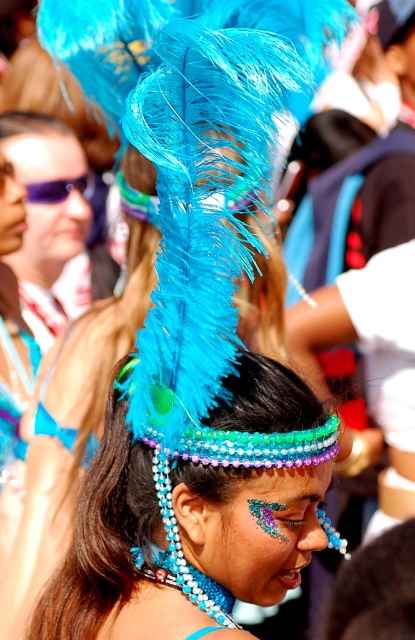
You are an event planner setting up a photo booth backdrop. The backdrop has a width of 1.2 meters. You want to place both the shiny blue feather headdress at center and the shiny blue feathers at center on the backdrop. Based on their widths, can they both fit side by side without overlapping?

The shiny blue feather headdress at center might be wider than shiny blue feathers at center, so it is uncertain if both can fit side by side on the 1.2 meter backdrop without overlapping. The exact widths are needed to determine this.

You are an event planner organizing a photo shoot for a cultural fashion show. You need to position a camera to capture the shiny blue feather headdress at center and the shiny blue feathers at center. Since both are at the center, how can you ensure the camera captures both elements clearly?

The shiny blue feather headdress at center is below shiny blue feathers at center, so positioning the camera slightly above the headdress will allow both elements to be in focus and visible.